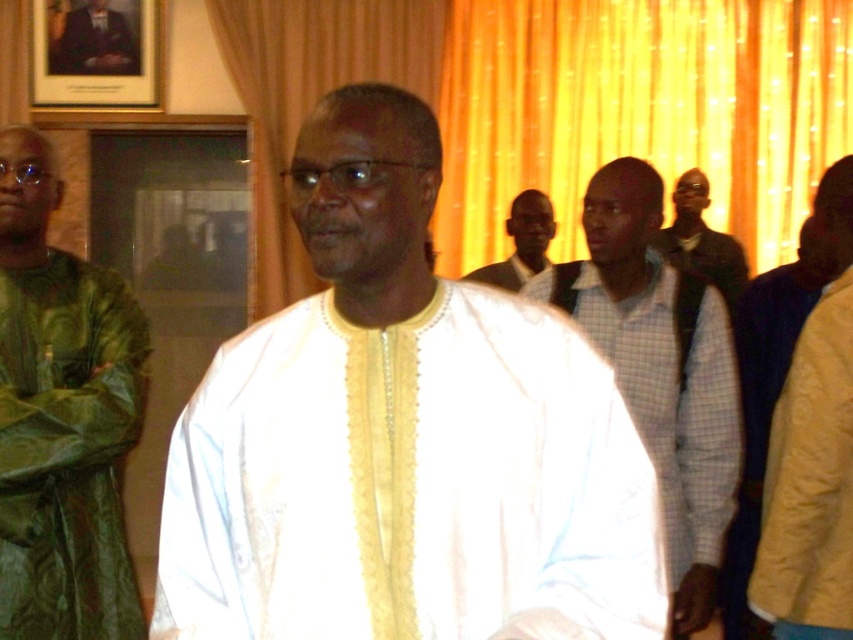
Question: Is white textured cloth at center thinner than dark brown leather jacket at right?

Choices:
 (A) no
 (B) yes

Answer: (A)

Question: Which point appears farthest from the camera in this image?

Choices:
 (A) (761, 572)
 (B) (701, 234)
 (C) (102, 632)

Answer: (B)

Question: Which point appears farthest from the camera in this image?

Choices:
 (A) (53, 333)
 (B) (433, 561)
 (C) (744, 275)

Answer: (C)

Question: Is white textured cloth at center to the left of light brown textured shirt at center from the viewer's perspective?

Choices:
 (A) no
 (B) yes

Answer: (B)

Question: Does white checkered shirt at center appear under light brown textured shirt at center?

Choices:
 (A) yes
 (B) no

Answer: (A)

Question: Which object appears closest to the camera in this image?

Choices:
 (A) green satin shirt at left
 (B) white checkered shirt at center
 (C) white textured robe at center
 (D) white textured cloth at center

Answer: (D)